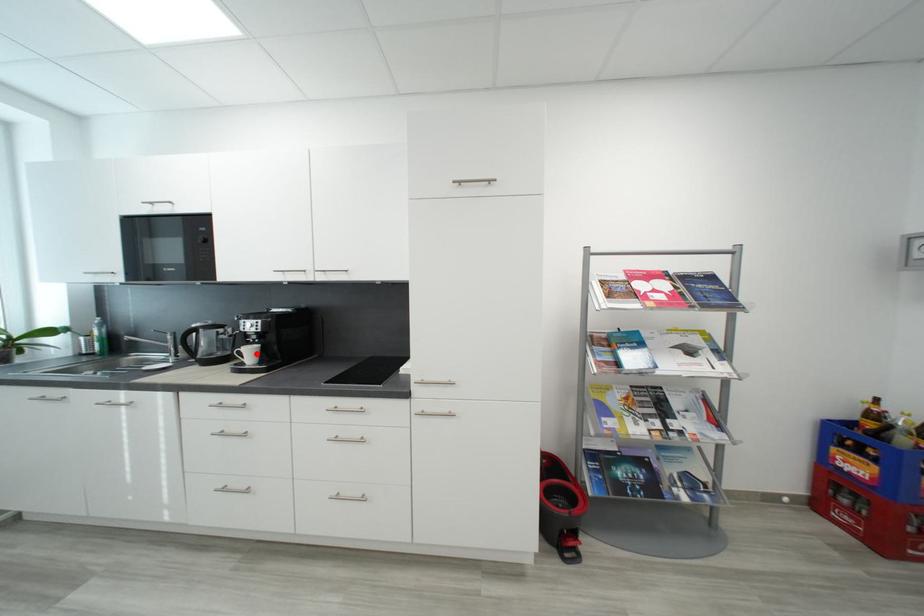
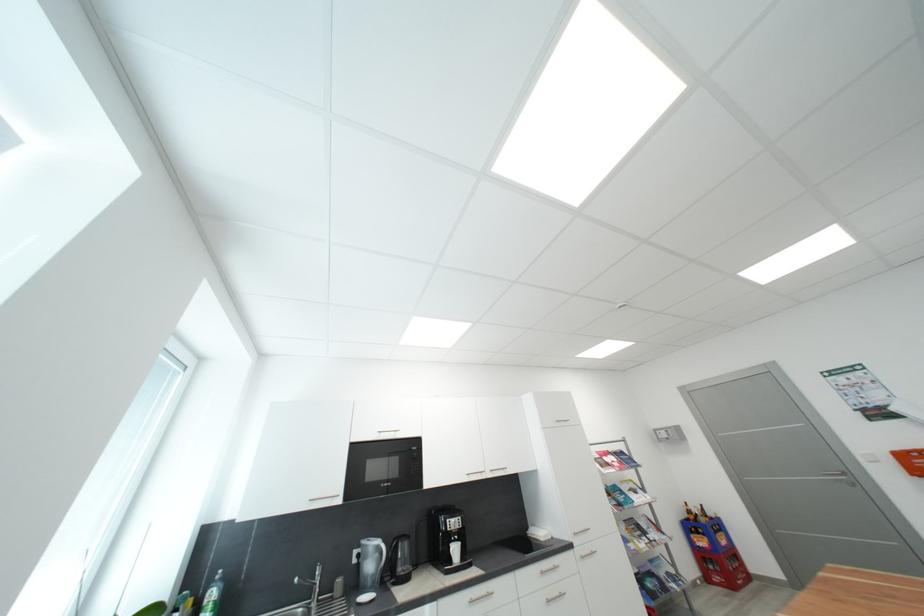
Question: I am providing you with two images of the same scene from different viewpoints. A red point is shown in image1. For the corresponding object point in image2, is it positioned nearer or farther from the camera?

Choices:
 (A) Nearer
 (B) Farther

Answer: (B)